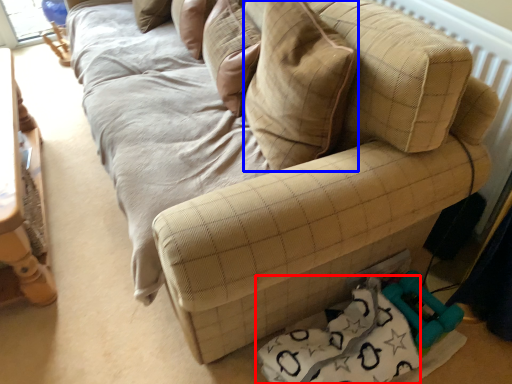
Question: Which object appears farthest to the camera in this image, material (highlighted by a red box) or throw pillow (highlighted by a blue box)?

Choices:
 (A) material
 (B) throw pillow

Answer: (A)